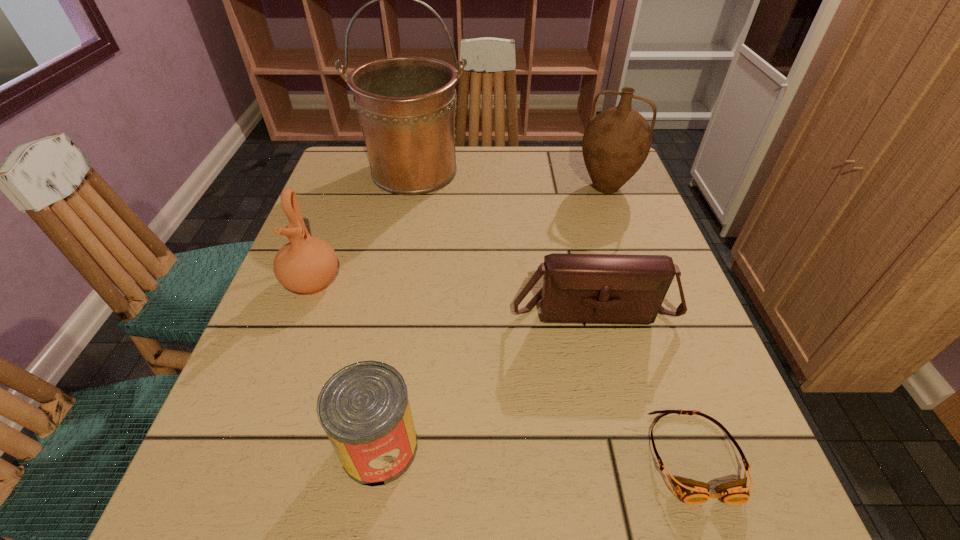
This screenshot has width=960, height=540. What are the coordinates of `object positioned at the far left corner` in the screenshot? It's located at (406, 106).

Where is `object that is at the far right corner`? object that is at the far right corner is located at coordinates (616, 142).

Identify the location of object present at the near right corner. The width and height of the screenshot is (960, 540). (692, 492).

This screenshot has width=960, height=540. In the image, there is a desktop. In order to click on free space at the far edge in this screenshot , I will do `click(546, 155)`.

Locate an element on the screen. The width and height of the screenshot is (960, 540). free space at the near edge of the desktop is located at coordinates (560, 517).

At what (x,y) coordinates should I click in order to perform the action: click on free space at the left edge of the desktop. Please return your answer as a coordinate pair (x, y). The image size is (960, 540). Looking at the image, I should click on (382, 197).

What are the coordinates of `vacant point at the right edge` in the screenshot? It's located at [641, 418].

At what (x,y) coordinates should I click in order to perform the action: click on vacant area at the far right corner. Please return your answer as a coordinate pair (x, y). Looking at the image, I should click on (572, 186).

In the image, there is a desktop. Where is `blank space at the near right corner`? blank space at the near right corner is located at coordinates (671, 525).

You are a GUI agent. You are given a task and a screenshot of the screen. Output one action in this format:
    pyautogui.click(x=<x>, y=<y>)
    Task: Click on the free area in between the shortest object and the shoulder bag
    
    Given the screenshot: What is the action you would take?
    pos(643,382)